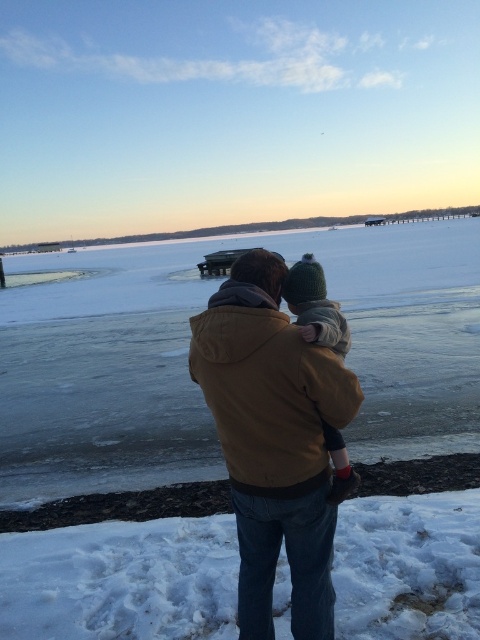
Who is more forward, (187, 557) or (296, 362)?

Positioned in front is point (296, 362).

Is point (57, 557) behind point (268, 288)?

That is True.

At what (x,y) coordinates should I click in order to perform the action: click on white fluffy snow at lower center. Please return your answer as a coordinate pair (x, y). The image size is (480, 640). Looking at the image, I should click on (120, 580).